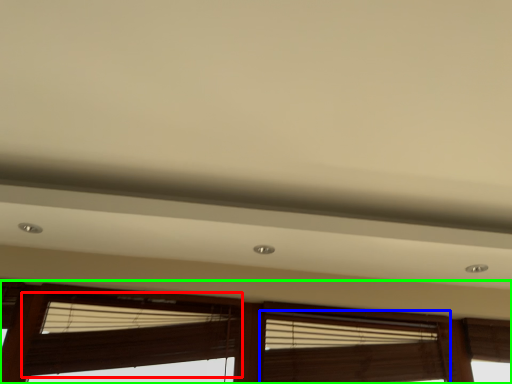
Question: Estimate the real-world distances between objects in this image. Which object is closer to window blind (highlighted by a red box), window blind (highlighted by a blue box) or window (highlighted by a green box)?

Choices:
 (A) window blind
 (B) window

Answer: (B)